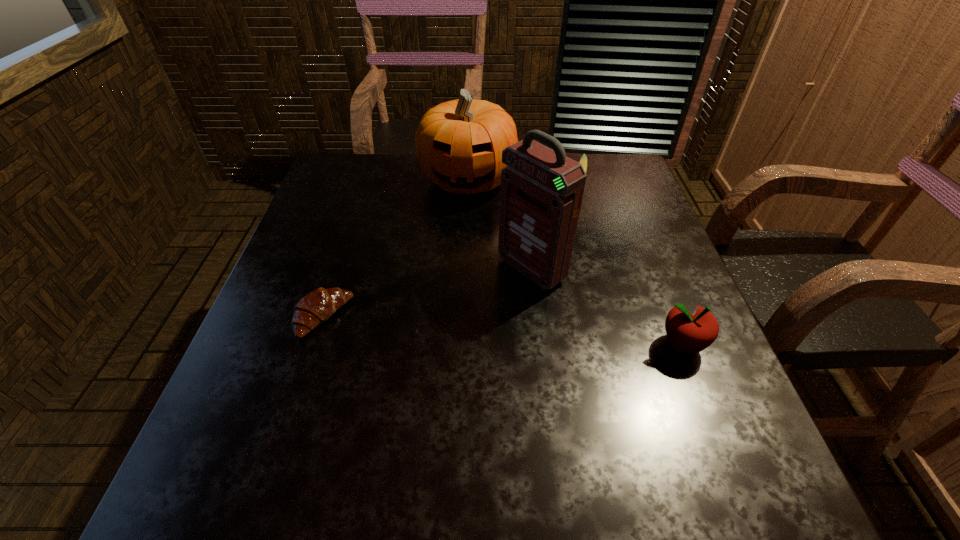
Where is `vacant space located on the left of the rightmost object`? vacant space located on the left of the rightmost object is located at coordinates (453, 345).

The width and height of the screenshot is (960, 540). What are the coordinates of `vacant space located on the front-facing side of the second tallest object` in the screenshot? It's located at (447, 320).

This screenshot has height=540, width=960. What are the coordinates of `vacant space located 0.370m on the front-facing side of the second tallest object` in the screenshot? It's located at (447, 316).

Image resolution: width=960 pixels, height=540 pixels. Find the location of `free space located on the front-facing side of the second tallest object`. free space located on the front-facing side of the second tallest object is located at coordinates (447, 320).

Find the location of a particular element. vacant point located 0.340m at the stem of the fourth object from left to right is located at coordinates (564, 283).

Identify the location of free location located at the stem of the fourth object from left to right. This screenshot has width=960, height=540. (562, 292).

This screenshot has width=960, height=540. I want to click on free space located 0.200m at the stem of the fourth object from left to right, so click(571, 244).

Where is `free space located 0.290m on the front-facing side of the first-aid kit`? Image resolution: width=960 pixels, height=540 pixels. free space located 0.290m on the front-facing side of the first-aid kit is located at coordinates (398, 360).

Identify the location of vacant area situated 0.340m on the front-facing side of the first-aid kit. (375, 375).

Find the location of a particular element. The image size is (960, 540). vacant space located on the front-facing side of the first-aid kit is located at coordinates (385, 369).